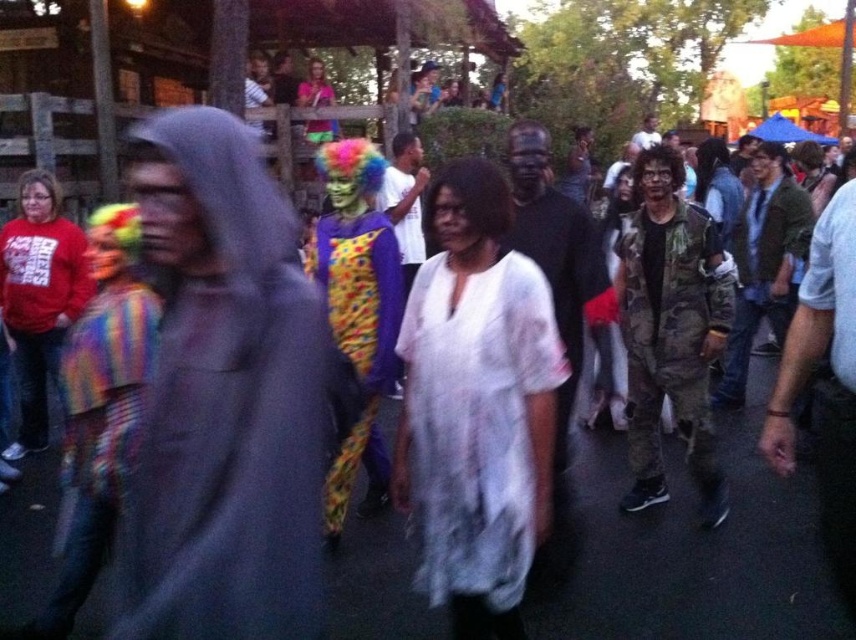
You are a photographer at the event and need to capture both the white sheer dress at center and the matte pink shirt at upper center in a single shot. Which subject should you focus on first to ensure both are in frame?

You should focus on the white sheer dress at center first because it is much taller than the matte pink shirt at upper center, so adjusting the camera angle to accommodate its height will also include the shorter matte pink shirt at upper center in the frame.

You are a photographer at the event and want to capture both the white sheer dress at center and the matte red sweatshirt at left in the same frame. Based on their positions, which one should you focus on first to ensure both are in the frame?

The white sheer dress at center is located below the matte red sweatshirt at left, so you should focus on the matte red sweatshirt at left first to ensure both are in the frame.

You are a photographer at the event and want to capture a photo where both the white sheer dress at center and the matte pink shirt at upper center are visible. Based on their sizes, which one might appear smaller in the photo?

The white sheer dress at center appears smaller in the photo because it is thinner than the matte pink shirt at upper center.